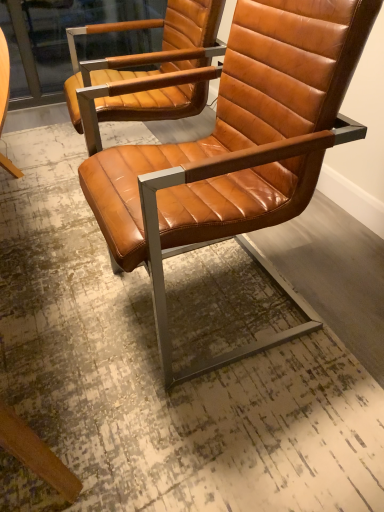
The height and width of the screenshot is (512, 384). In order to click on free space to the left of cognac leather chair at center in this screenshot , I will do `click(55, 306)`.